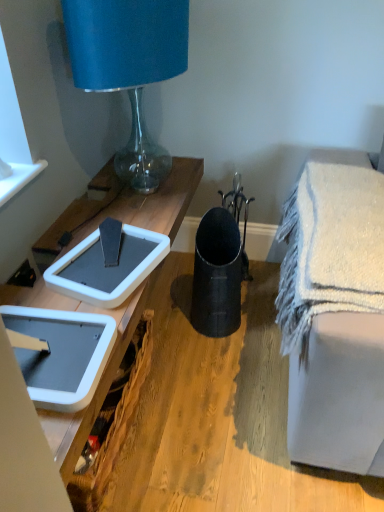
Question: Considering the positions of white plastic picnic basket at lower left and blue fabric lampshade at upper left in the image, is white plastic picnic basket at lower left wider or thinner than blue fabric lampshade at upper left?

Choices:
 (A) thin
 (B) wide

Answer: (A)

Question: From the image's perspective, is white plastic picnic basket at lower left located above or below blue fabric lampshade at upper left?

Choices:
 (A) above
 (B) below

Answer: (B)

Question: Which of these objects is positioned farthest from the blue fabric lampshade at upper left?

Choices:
 (A) white textured bath towel at lower right
 (B) matte black vase at center
 (C) white plastic picnic basket at lower left

Answer: (B)

Question: Considering the real-world distances, which object is closest to the white plastic picnic basket at lower left?

Choices:
 (A) white textured bath towel at lower right
 (B) matte black vase at center
 (C) blue fabric lampshade at upper left

Answer: (B)